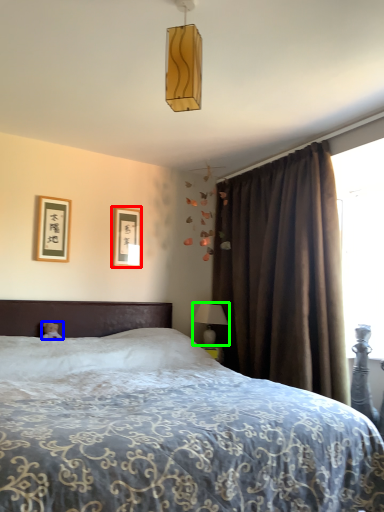
Question: Estimate the real-world distances between objects in this image. Which object is closer to picture frame (highlighted by a red box), teddy bear (highlighted by a blue box) or table lamp (highlighted by a green box)?

Choices:
 (A) teddy bear
 (B) table lamp

Answer: (B)